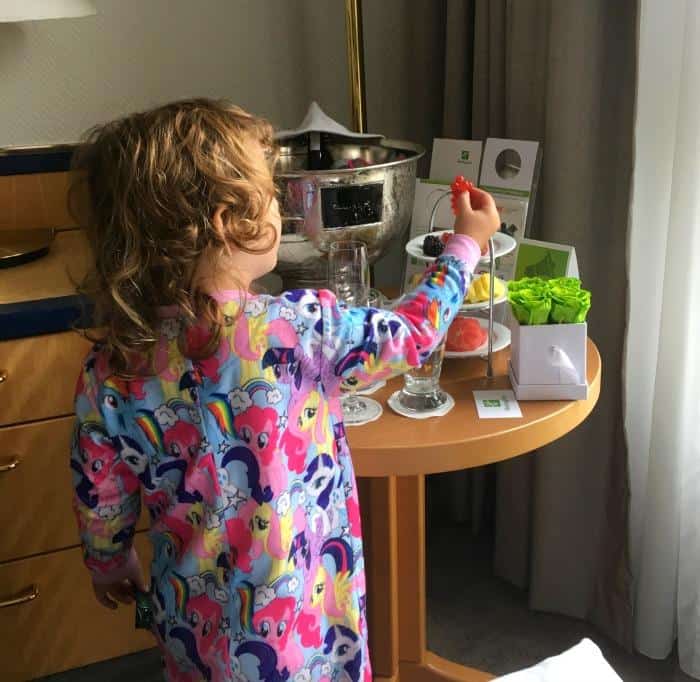
You are a GUI agent. You are given a task and a screenshot of the screen. Output one action in this format:
    pyautogui.click(x=<x>, y=<y>)
    Task: Click on the curtains
    The image size is (700, 682).
    Given the screenshot: What is the action you would take?
    tap(673, 218), tap(565, 89)